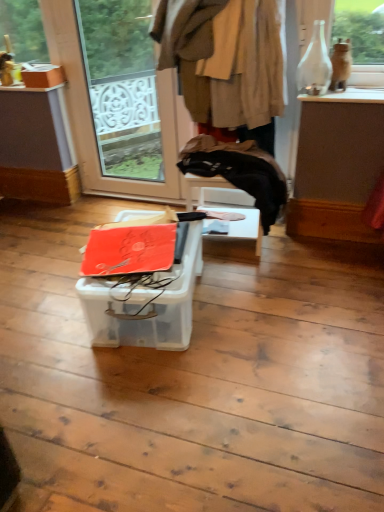
Question: Based on their positions, is brown woolen coat at upper center located to the left or right of transparent glass door at upper left?

Choices:
 (A) right
 (B) left

Answer: (A)

Question: Looking at their shapes, would you say brown woolen coat at upper center is wider or thinner than transparent glass door at upper left?

Choices:
 (A) thin
 (B) wide

Answer: (B)

Question: Which of these objects is positioned farthest from the brown woolen coat at upper center?

Choices:
 (A) orange matte cardboard box at center, acting as the first cardboard box starting from the front
 (B) transparent glass door at upper left
 (C) white glossy vase at upper right
 (D) matte cardboard box at upper left, the second cardboard box when ordered from bottom to top

Answer: (B)

Question: Estimate the real-world distances between objects in this image. Which object is closer to the orange matte cardboard box at center, positioned as the second cardboard box in left-to-right order?

Choices:
 (A) brown woolen coat at upper center
 (B) matte cardboard box at upper left, marked as the first cardboard box in a left-to-right arrangement
 (C) white glossy vase at upper right
 (D) transparent glass door at upper left

Answer: (A)